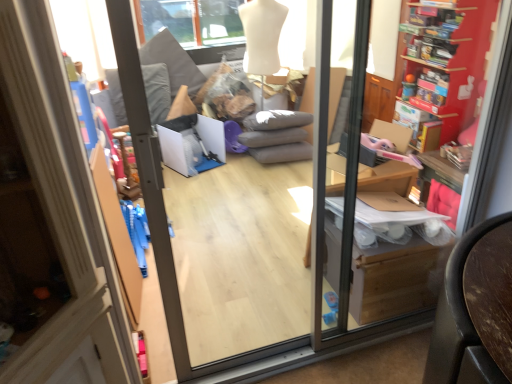
Question: Is transparent glass screen door at center in contact with matte cardboard box at right?

Choices:
 (A) no
 (B) yes

Answer: (A)

Question: Is transparent glass screen door at center positioned beyond the bounds of matte cardboard box at right?

Choices:
 (A) yes
 (B) no

Answer: (A)

Question: Can you confirm if transparent glass screen door at center is shorter than matte cardboard box at right?

Choices:
 (A) no
 (B) yes

Answer: (A)

Question: Are transparent glass screen door at center and matte cardboard box at right far apart?

Choices:
 (A) yes
 (B) no

Answer: (B)

Question: Does transparent glass screen door at center come behind matte cardboard box at right?

Choices:
 (A) no
 (B) yes

Answer: (A)

Question: In the image, is transparent glass screen door at center positioned in front of or behind wooden bookshelf at right?

Choices:
 (A) behind
 (B) front

Answer: (B)

Question: Is transparent glass screen door at center to the left or to the right of wooden bookshelf at right in the image?

Choices:
 (A) right
 (B) left

Answer: (B)

Question: Is transparent glass screen door at center wider or thinner than wooden bookshelf at right?

Choices:
 (A) wide
 (B) thin

Answer: (B)

Question: From the image's perspective, relative to wooden bookshelf at right, is transparent glass screen door at center above or below?

Choices:
 (A) below
 (B) above

Answer: (A)

Question: Is matte cardboard box at right in front of or behind transparent glass screen door at center in the image?

Choices:
 (A) behind
 (B) front

Answer: (A)

Question: Is matte cardboard box at right inside the boundaries of transparent glass screen door at center, or outside?

Choices:
 (A) outside
 (B) inside

Answer: (A)

Question: Is matte cardboard box at right to the left or to the right of transparent glass screen door at center in the image?

Choices:
 (A) left
 (B) right

Answer: (B)

Question: Considering the positions of point (367, 312) and point (181, 347), is point (367, 312) closer or farther from the camera than point (181, 347)?

Choices:
 (A) closer
 (B) farther

Answer: (B)

Question: Is wooden bookshelf at right to the left or to the right of transparent glass screen door at center in the image?

Choices:
 (A) right
 (B) left

Answer: (A)

Question: Considering the positions of wooden bookshelf at right and transparent glass screen door at center in the image, is wooden bookshelf at right taller or shorter than transparent glass screen door at center?

Choices:
 (A) short
 (B) tall

Answer: (A)